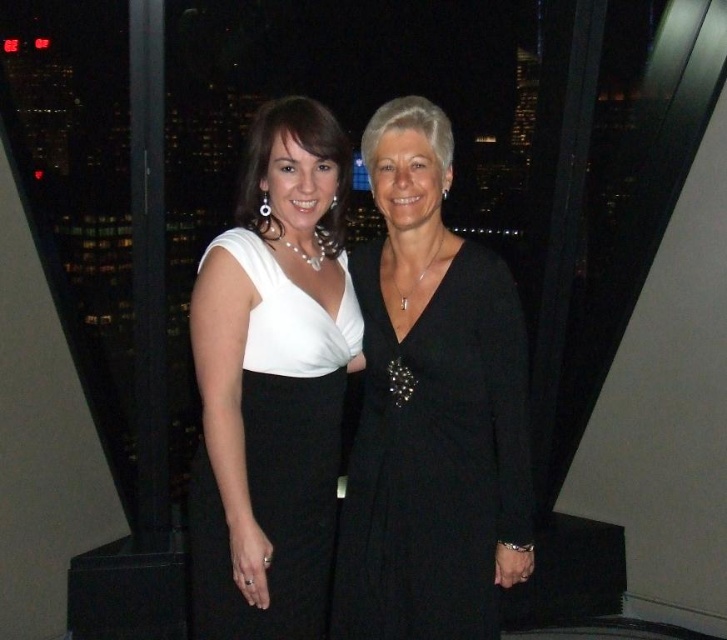
The width and height of the screenshot is (727, 640). What do you see at coordinates (430, 408) in the screenshot? I see `black satin dress at center` at bounding box center [430, 408].

Is black satin dress at center shorter than white satin dress at center?

No, black satin dress at center is not shorter than white satin dress at center.

Find the location of a particular element. black satin dress at center is located at coordinates (430, 408).